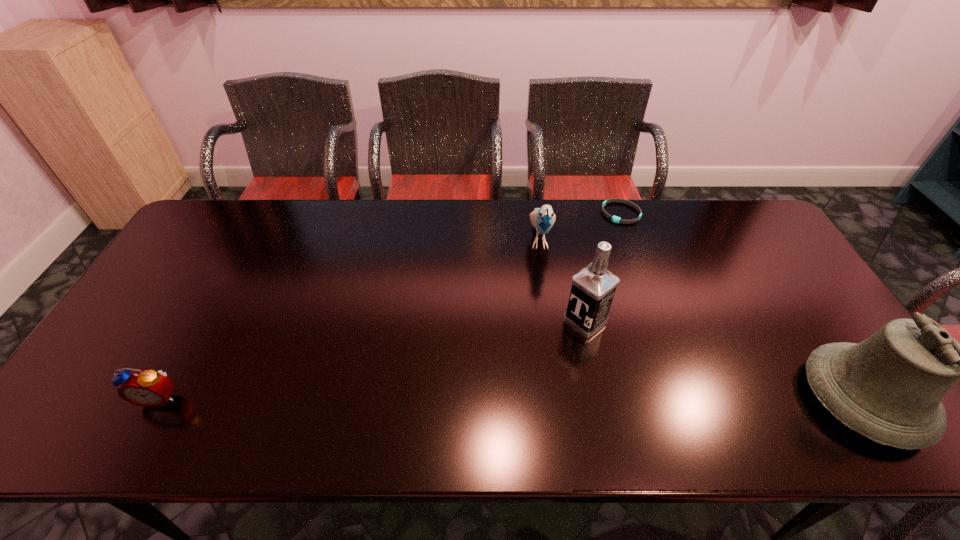
The width and height of the screenshot is (960, 540). I want to click on vacant space positioned at the face of the bird, so click(545, 301).

This screenshot has width=960, height=540. I want to click on free space located at the face of the bird, so click(x=549, y=379).

Image resolution: width=960 pixels, height=540 pixels. In order to click on free space located on the front label of the vodka in this screenshot , I will do `click(559, 342)`.

Where is `vacant space located 0.250m on the front label of the vodka`? vacant space located 0.250m on the front label of the vodka is located at coordinates (503, 388).

Where is `vacant region located on the front label of the vodka`? This screenshot has height=540, width=960. vacant region located on the front label of the vodka is located at coordinates (538, 360).

Where is `wristband that is at the far edge`? wristband that is at the far edge is located at coordinates (615, 219).

You are a GUI agent. You are given a task and a screenshot of the screen. Output one action in this format:
    pyautogui.click(x=<x>, y=<y>)
    Task: Click on the bird at the far edge
    
    Given the screenshot: What is the action you would take?
    pyautogui.click(x=543, y=218)

Where is `object that is at the near edge`? The height and width of the screenshot is (540, 960). object that is at the near edge is located at coordinates (148, 388).

Where is `object at the left edge`? object at the left edge is located at coordinates (148, 388).

At what (x,y) coordinates should I click in order to perform the action: click on object positioned at the near left corner. Please return your answer as a coordinate pair (x, y). This screenshot has height=540, width=960. Looking at the image, I should click on (148, 388).